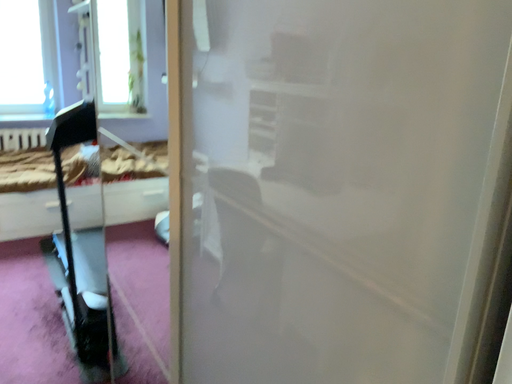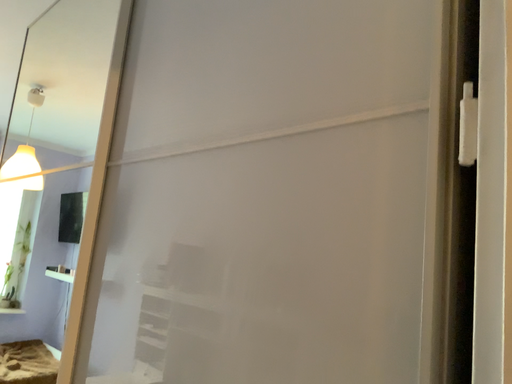
Question: How did the camera likely rotate when shooting the video?

Choices:
 (A) rotated upward
 (B) rotated downward

Answer: (A)